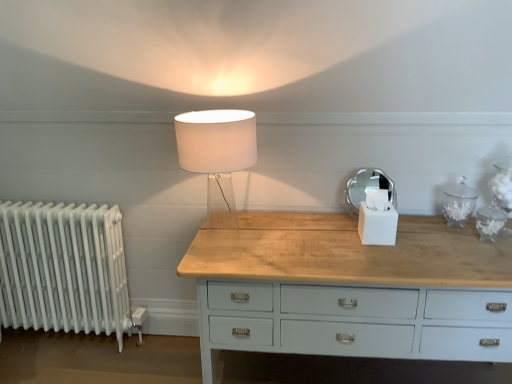
Question: Visually, is translucent glass lamp at center positioned to the left or to the right of white metallic radiator at left?

Choices:
 (A) left
 (B) right

Answer: (B)

Question: Relative to white metallic radiator at left, is translucent glass lamp at center in front or behind?

Choices:
 (A) front
 (B) behind

Answer: (A)

Question: Which object is the farthest from the translucent glass lamp at center?

Choices:
 (A) white metallic radiator at left
 (B) white matte tissue box at center

Answer: (A)

Question: Which is farther from the white metallic radiator at left?

Choices:
 (A) white matte tissue box at center
 (B) translucent glass lamp at center

Answer: (A)